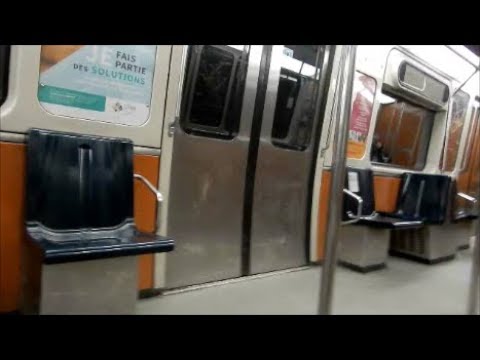
The image size is (480, 360). Identify the location of door. (228, 185).